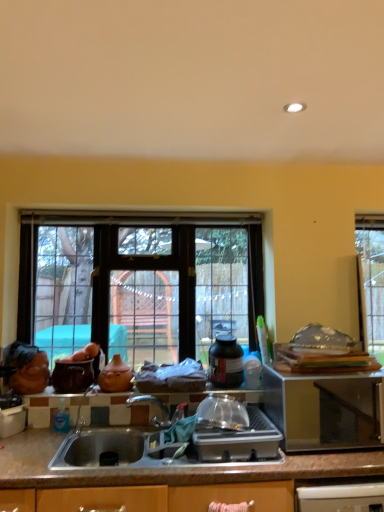
Question: Is matte black bottle at center, which is the second bottle in bottom-to-top order, taller than stainless steel microwave at right, positioned as the first appliance in right-to-left order?

Choices:
 (A) no
 (B) yes

Answer: (A)

Question: Can you confirm if matte black bottle at center, acting as the 1th bottle starting from the back, is thinner than stainless steel microwave at right, which ranks as the second appliance in left-to-right order?

Choices:
 (A) no
 (B) yes

Answer: (B)

Question: Can you confirm if matte black bottle at center, which appears as the second bottle when viewed from the left, is positioned to the left of stainless steel microwave at right, positioned as the first appliance in right-to-left order?

Choices:
 (A) yes
 (B) no

Answer: (A)

Question: From the image's perspective, is matte black bottle at center, which appears as the second bottle when viewed from the left, above stainless steel microwave at right, positioned as the first appliance in right-to-left order?

Choices:
 (A) yes
 (B) no

Answer: (A)

Question: From a real-world perspective, is matte black bottle at center, placed as the 1th bottle when sorted from right to left, beneath stainless steel microwave at right, which ranks as the second appliance in left-to-right order?

Choices:
 (A) no
 (B) yes

Answer: (A)

Question: Can you confirm if matte black bottle at center, placed as the 1th bottle when sorted from right to left, is positioned to the right of stainless steel microwave at right, which ranks as the second appliance in left-to-right order?

Choices:
 (A) yes
 (B) no

Answer: (B)

Question: Is brown granite countertop at lower center to the left of stainless steel microwave at right, positioned as the first appliance in right-to-left order, from the viewer's perspective?

Choices:
 (A) yes
 (B) no

Answer: (A)

Question: Can you confirm if brown granite countertop at lower center is wider than stainless steel microwave at right, positioned as the first appliance in right-to-left order?

Choices:
 (A) no
 (B) yes

Answer: (B)

Question: Does brown granite countertop at lower center turn towards stainless steel microwave at right, positioned as the first appliance in right-to-left order?

Choices:
 (A) no
 (B) yes

Answer: (A)

Question: From the image's perspective, is brown granite countertop at lower center on top of stainless steel microwave at right, positioned as the first appliance in right-to-left order?

Choices:
 (A) yes
 (B) no

Answer: (B)

Question: From a real-world perspective, is brown granite countertop at lower center physically below stainless steel microwave at right, which ranks as the second appliance in left-to-right order?

Choices:
 (A) no
 (B) yes

Answer: (B)

Question: Can you confirm if brown granite countertop at lower center is smaller than stainless steel microwave at right, which ranks as the second appliance in left-to-right order?

Choices:
 (A) yes
 (B) no

Answer: (B)

Question: Is clear plastic container at center thinner than matte ceramic vase at center?

Choices:
 (A) no
 (B) yes

Answer: (A)